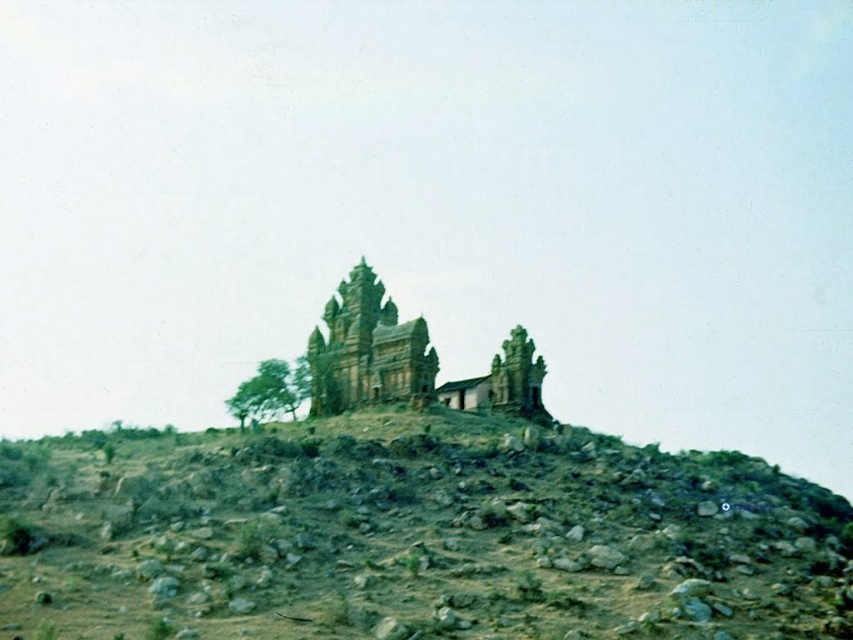
Between brown rocky hillside at center and green leafy tree at center, which one has less height?

With less height is green leafy tree at center.

Does brown rocky hillside at center appear over green leafy tree at center?

No.

Where is `brown rocky hillside at center`? This screenshot has height=640, width=853. brown rocky hillside at center is located at coordinates (412, 536).

Looking at this image, between brown stone ruins at center and green leafy tree at center, which one has less height?

green leafy tree at center is shorter.

The image size is (853, 640). Describe the element at coordinates (367, 349) in the screenshot. I see `brown stone ruins at center` at that location.

Does point (387, 337) lie in front of point (242, 381)?

Yes, it is.

This screenshot has width=853, height=640. What are the coordinates of `brown stone ruins at center` in the screenshot? It's located at (367, 349).

Is brown rocky hillside at center below brown stone ruins at center?

Correct, brown rocky hillside at center is located below brown stone ruins at center.

Who is more distant from viewer, [390,566] or [358,368]?

The point [358,368] is behind.

Identify the location of brown rocky hillside at center. (412, 536).